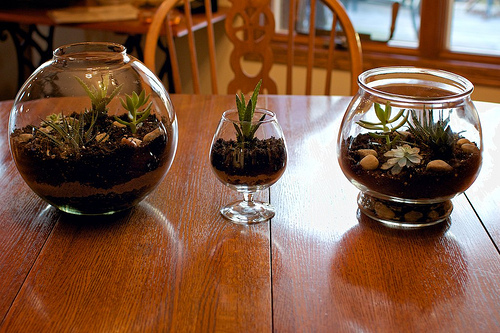
Where is `brandy glass`? The image size is (500, 333). brandy glass is located at coordinates (247, 196).